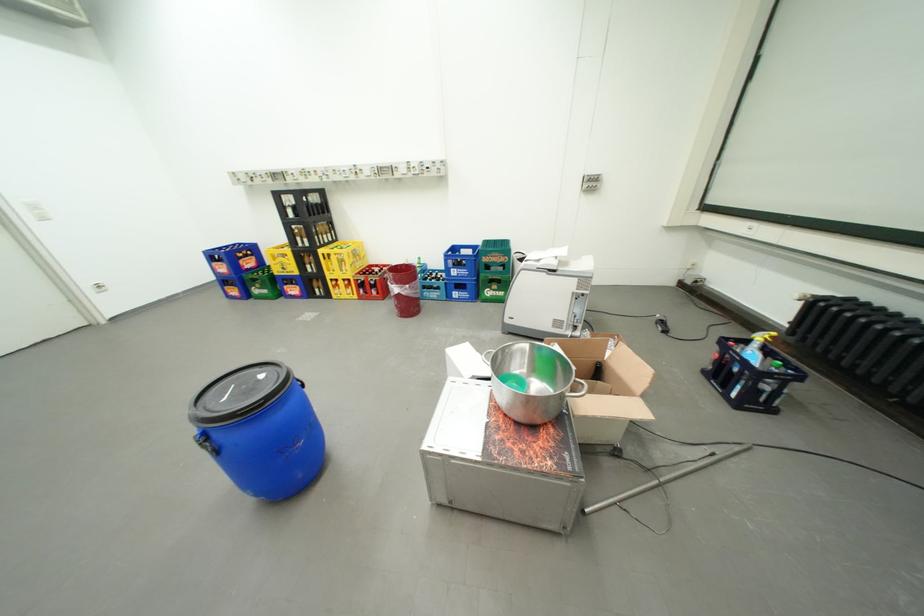
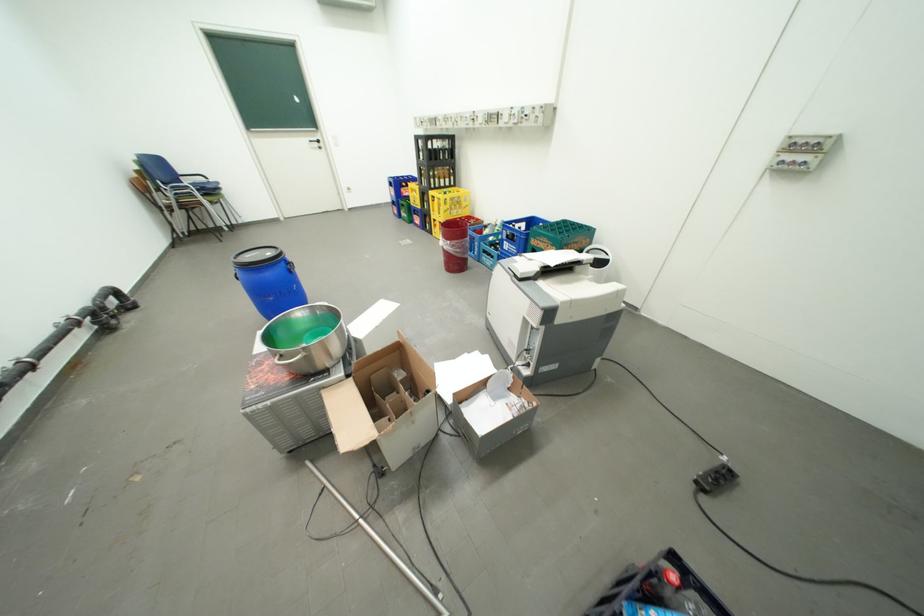
The point at (x=513, y=257) is marked in the first image. Where is the corresponding point in the second image?

(562, 246)